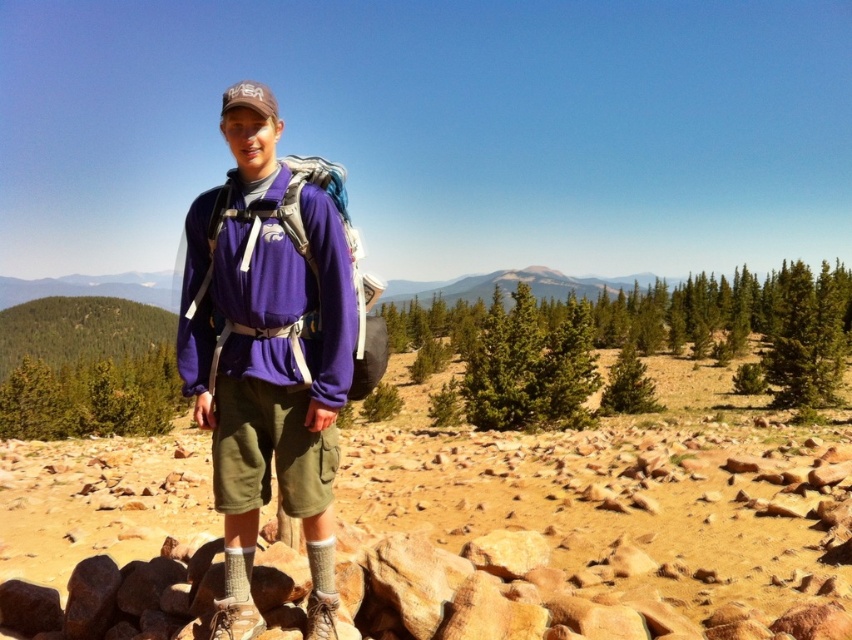
You are a photographer trying to capture the person in the scene. Since both the purple fleece jacket at center and the matte purple backpack at center are purple, how can you tell them apart in your photo?

The purple fleece jacket at center is larger in size than the matte purple backpack at center, so the larger purple item is the jacket and the smaller one is the backpack.

Based on the photo, you are a hiker who just arrived at the mountain trail. You see the purple fleece jacket at center and the matte purple backpack at center. Which item is positioned more to the left?

The purple fleece jacket at center is positioned to the left of the matte purple backpack at center, so the purple fleece jacket at center is more to the left.